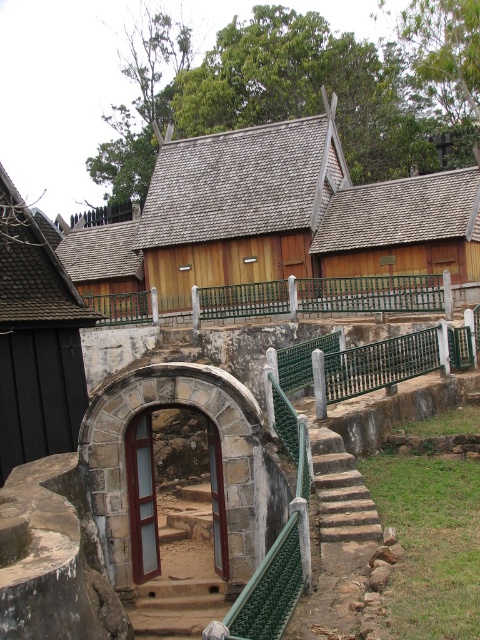
Question: Does green metal railing at center appear on the right side of brown stone stairs at center?

Choices:
 (A) yes
 (B) no

Answer: (A)

Question: Is green metal railing at center thinner than stone textured stairs at center?

Choices:
 (A) no
 (B) yes

Answer: (A)

Question: Which is nearer to the green metal railing at center?

Choices:
 (A) wooden hut at center
 (B) brown stone stairs at center
 (C) stone textured stairs at center
 (D) dark brown wood at left

Answer: (A)

Question: Can you confirm if green metal railing at center is positioned to the left of stone textured stairs at center?

Choices:
 (A) no
 (B) yes

Answer: (B)

Question: Which point is farther to the camera?

Choices:
 (A) dark brown wood at left
 (B) wooden hut at center
 (C) stone textured stairs at center
 (D) brown stone stairs at center

Answer: (B)

Question: Which point appears farthest from the camera in this image?

Choices:
 (A) (208, 291)
 (B) (212, 256)
 (C) (2, 458)
 (D) (364, 486)

Answer: (B)